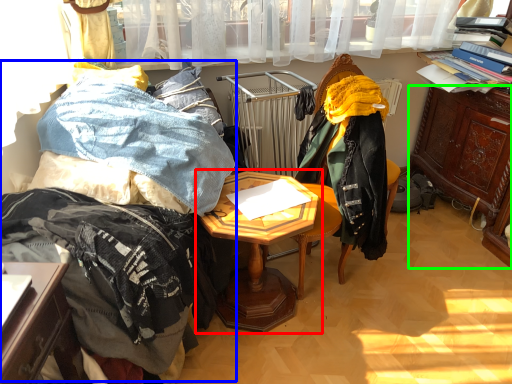
Question: Which object is positioned farthest from table (highlighted by a red box)? Select from bed (highlighted by a blue box) and cabinetry (highlighted by a green box).

Choices:
 (A) bed
 (B) cabinetry

Answer: (B)